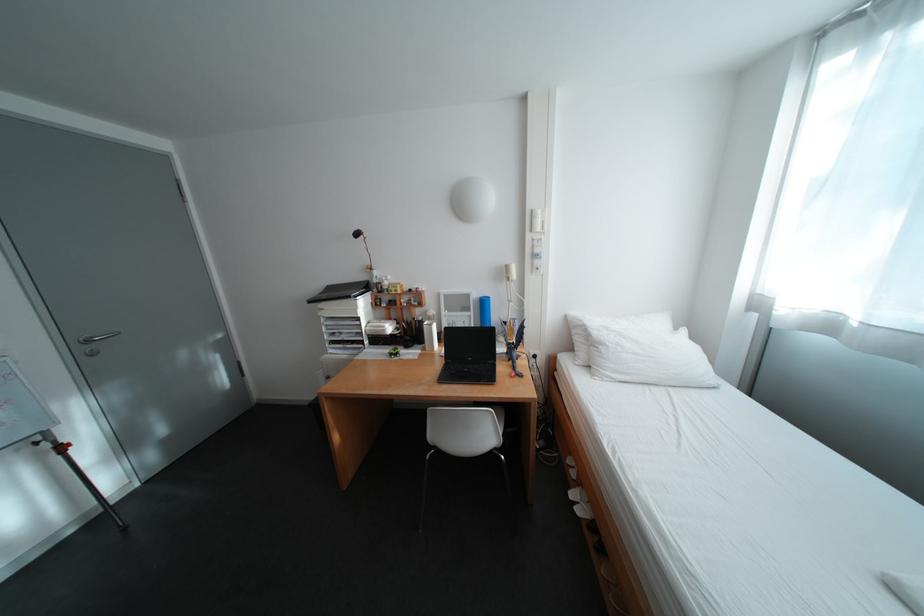
Find the location of a particular element. This screenshot has height=616, width=924. chair sitting surface is located at coordinates (485, 411).